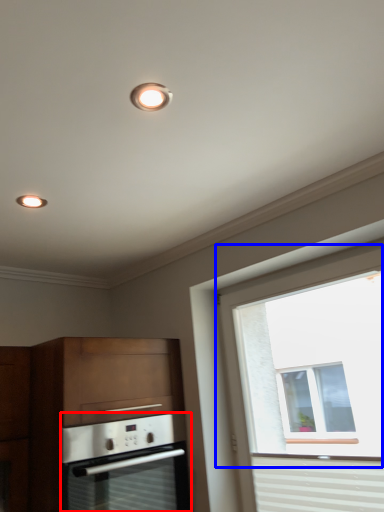
Question: Which object is closer to the camera taking this photo, oven (highlighted by a red box) or window (highlighted by a blue box)?

Choices:
 (A) oven
 (B) window

Answer: (B)